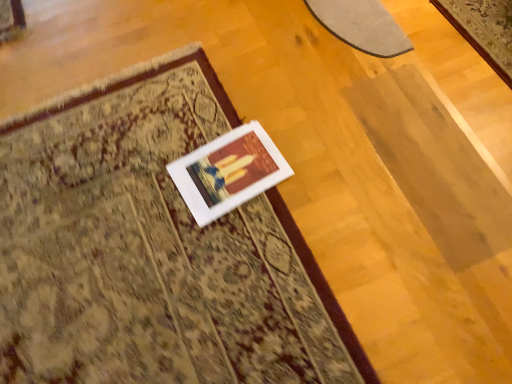
Locate an element on the screen. The height and width of the screenshot is (384, 512). vacant space in front of white matte picture frame at center is located at coordinates (239, 251).